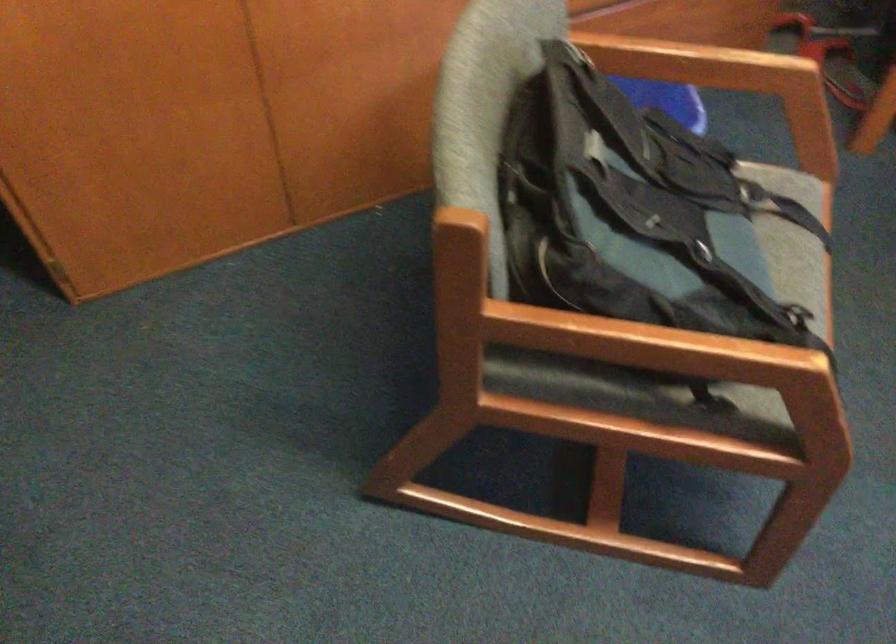
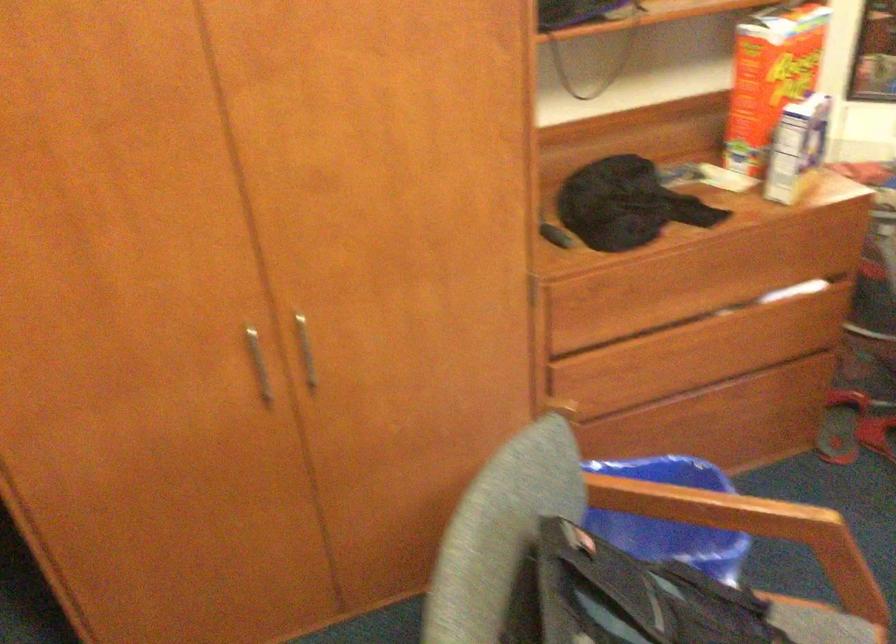
Question: The first image is from the beginning of the video and the second image is from the end. How did the camera likely rotate when shooting the video?

Choices:
 (A) Left
 (B) Right
 (C) Up
 (D) Down

Answer: (C)